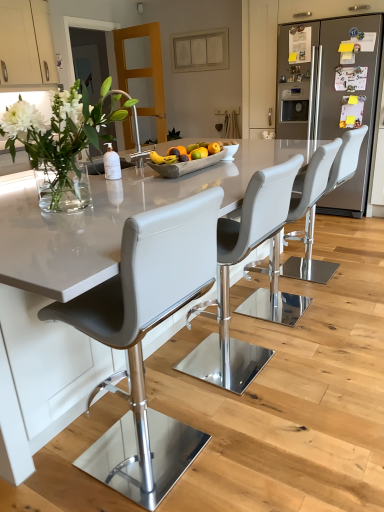
At what (x,y) coordinates should I click in order to perform the action: click on vacant space to the right of white leather bar stool at center, the second chair in the front-to-back sequence. Please return your answer as a coordinate pair (x, y). The height and width of the screenshot is (512, 384). Looking at the image, I should click on (318, 364).